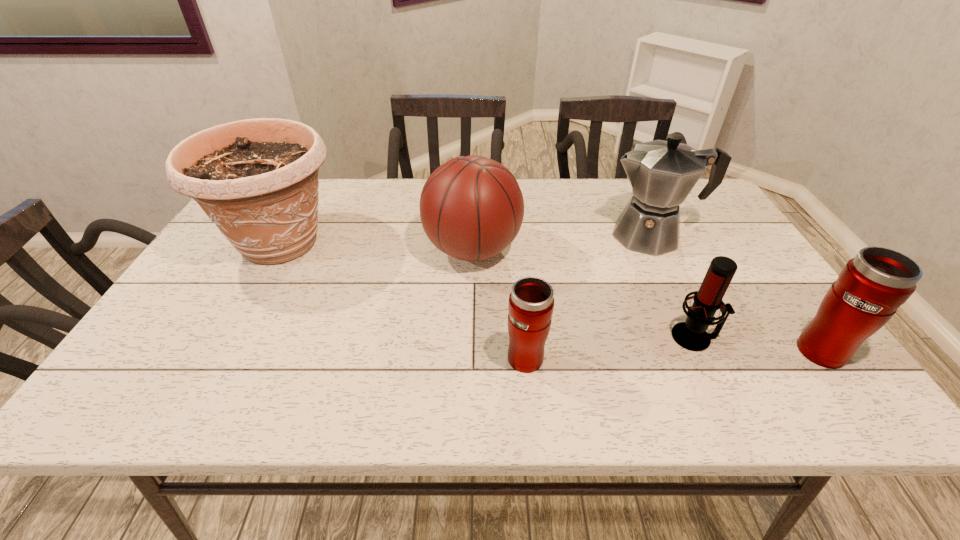
At what (x,y) coordinates should I click in order to perform the action: click on vacant space that is in between the microphone and the shorter thermos bottle. Please return your answer as a coordinate pair (x, y). This screenshot has height=540, width=960. Looking at the image, I should click on point(611,347).

Locate which object ranks fourth in proximity to the rightmost object. Please provide its 2D coordinates. Your answer should be formatted as a tuple, i.e. [(x, y)], where the tuple contains the x and y coordinates of a point satisfying the conditions above.

[(471, 207)]

This screenshot has height=540, width=960. I want to click on object that ranks as the fourth closest to the coffeepot, so click(x=531, y=302).

Locate an element on the screen. The height and width of the screenshot is (540, 960). free space that satisfies the following two spatial constraints: 1. at the spout of the coffeepot; 2. on the side with the handle of the taller thermos bottle is located at coordinates (706, 348).

At what (x,y) coordinates should I click in order to perform the action: click on vacant space that satisfies the following two spatial constraints: 1. at the spout of the coffeepot; 2. on the side with the handle of the taller thermos bottle. Please return your answer as a coordinate pair (x, y). The image size is (960, 540). Looking at the image, I should click on (706, 348).

Identify the location of free space that satisfies the following two spatial constraints: 1. on the side with the handle of the left thermos bottle; 2. on the left side of the microphone. The image size is (960, 540). (525, 337).

Find the location of `vacant area in the image that satisfies the following two spatial constraints: 1. at the spout of the coffeepot; 2. on the front side of the leftmost object`. vacant area in the image that satisfies the following two spatial constraints: 1. at the spout of the coffeepot; 2. on the front side of the leftmost object is located at coordinates (655, 242).

Locate an element on the screen. Image resolution: width=960 pixels, height=540 pixels. vacant space that satisfies the following two spatial constraints: 1. at the spout of the coffeepot; 2. on the front side of the flowerpot is located at coordinates (655, 242).